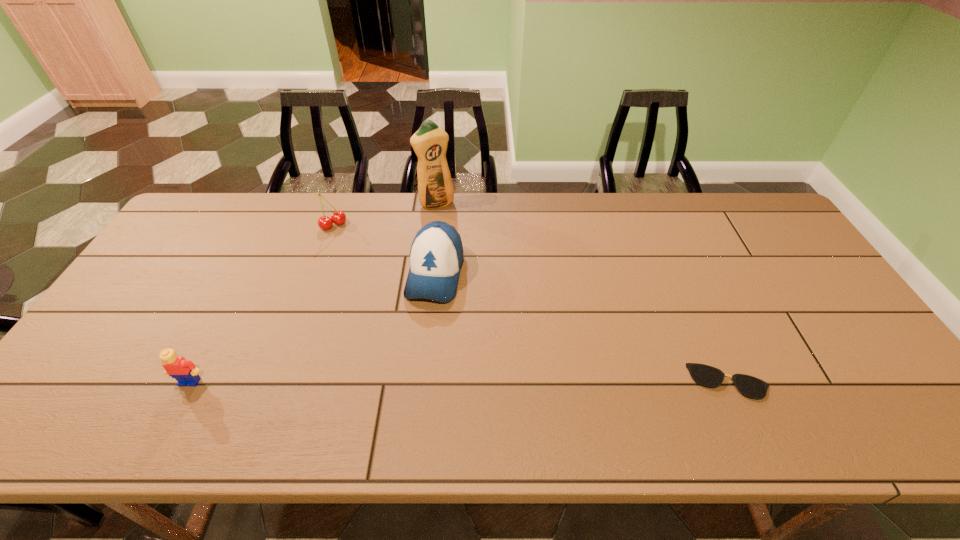
The width and height of the screenshot is (960, 540). In order to click on free spot on the desktop that is between the leftmost object and the rightmost object and is positioned on the label of the tallest object in this screenshot , I will do `click(531, 382)`.

Where is `vacant space on the desktop that is between the Lego and the shortest object and is positioned with the stems of the second farthest object pointing upwards`? The height and width of the screenshot is (540, 960). vacant space on the desktop that is between the Lego and the shortest object and is positioned with the stems of the second farthest object pointing upwards is located at coordinates (445, 382).

Find the location of `free space on the desktop that is between the leftmost object and the shortest object and is positioned on the front-facing side of the baseball cap`. free space on the desktop that is between the leftmost object and the shortest object and is positioned on the front-facing side of the baseball cap is located at coordinates (405, 382).